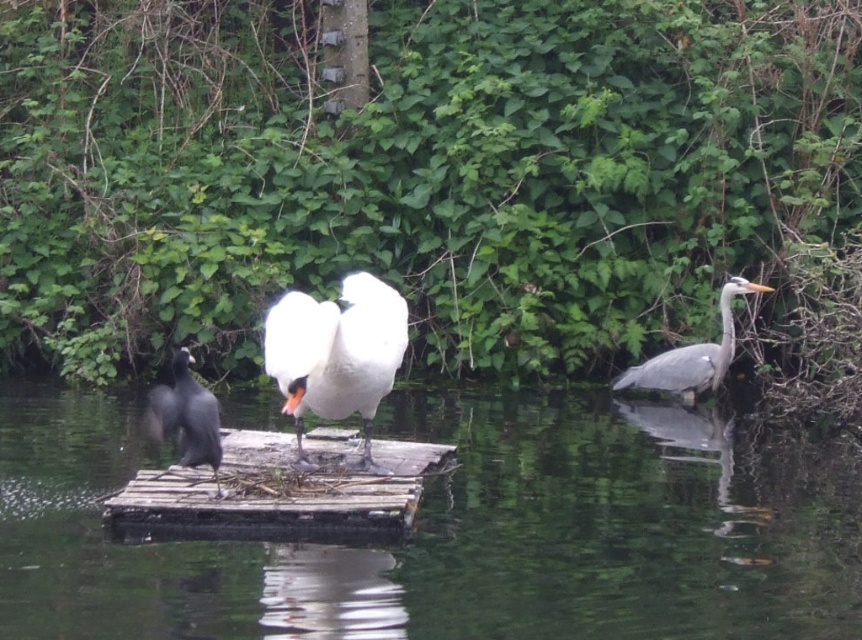
You are standing on the wooden platform and want to reach a small insect located at point (342, 353) and a shiny pebble at point (742, 284). Which object will you reach first if you move straight ahead from your current position?

You will reach the small insect located at point (342, 353) first because it is closer to the camera than the shiny pebble at point (742, 284).

You are a photographer trying to capture a clear shot of the black glossy bird at left and the clear water at center. Based on their positions, which object is located lower in the image?

The clear water at center is located lower than the black glossy bird at left in the image.

You are standing on the edge of the platform and want to place a small toy boat in the water. Since the clear water at center and the white feathered swan at center are both in your view, which one should you aim for to ensure the boat floats freely without hitting the swan?

The clear water at center has a smaller size compared to the white feathered swan at center, so you should aim for the area around the white feathered swan at center where there is more space to ensure the boat floats freely without hitting the swan.